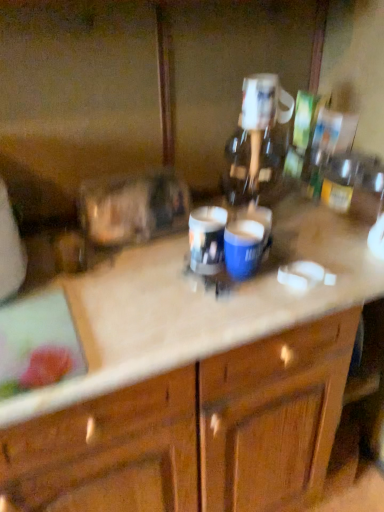
I want to click on free space in front of matte plastic cup at center, which is counted as the 1th beverage, starting from the left, so click(200, 309).